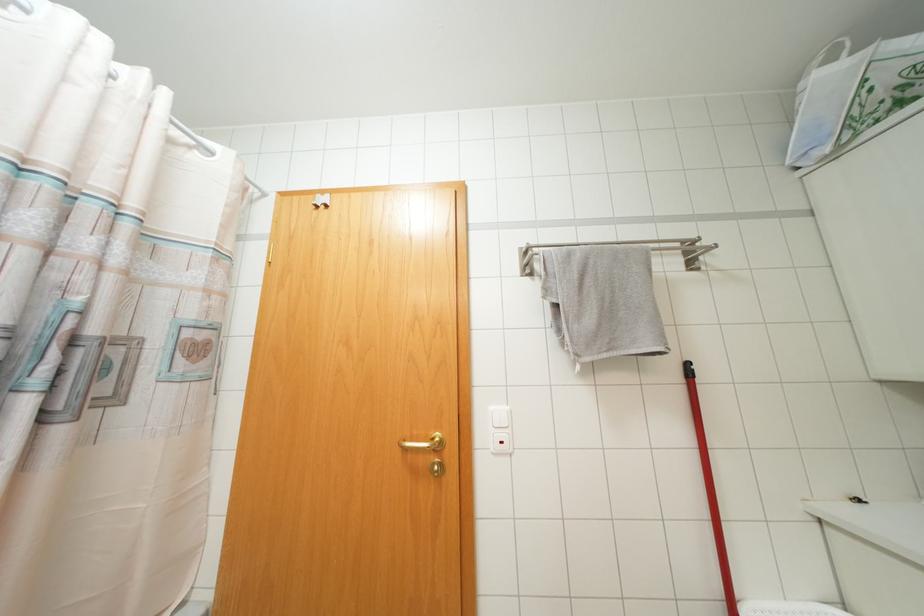
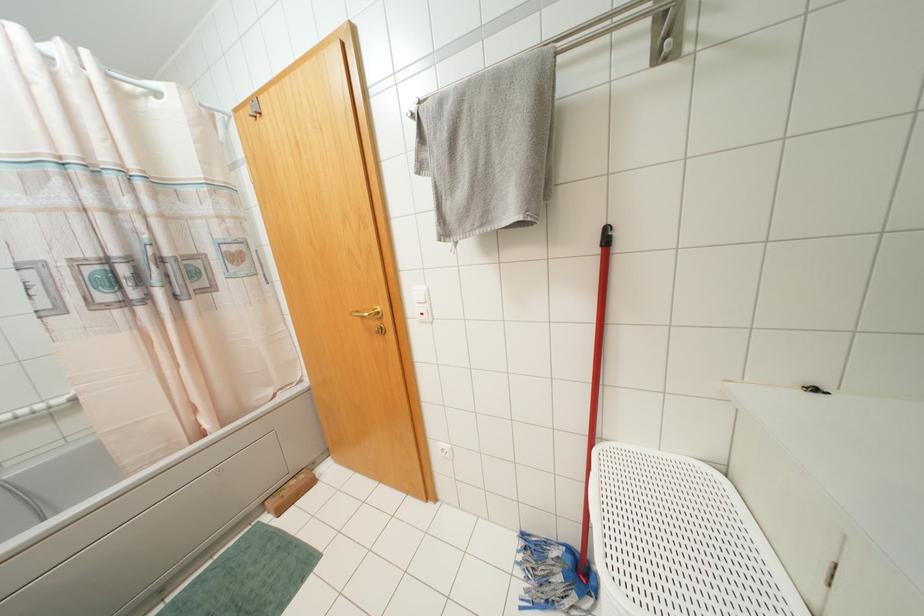
Locate, in the second image, the point that corresponds to (440,440) in the first image.

(378, 312)